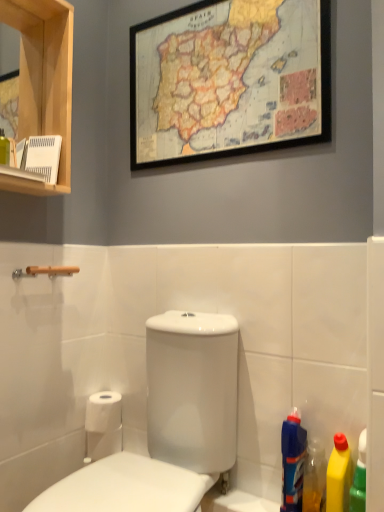
Question: Looking at their shapes, would you say blue plastic bottle at lower right, acting as the 1th cleaning product starting from the left, is wider or thinner than white glossy toilet at center?

Choices:
 (A) wide
 (B) thin

Answer: (B)

Question: From a real-world perspective, relative to white glossy toilet at center, is blue plastic bottle at lower right, acting as the 1th cleaning product starting from the left, vertically above or below?

Choices:
 (A) above
 (B) below

Answer: (B)

Question: Estimate the real-world distances between objects in this image. Which object is farther from the white glossy toilet at center?

Choices:
 (A) yellow plastic bottle at lower right, which is counted as the first cleaning product, starting from the right
 (B) blue plastic bottle at lower right, acting as the 1th cleaning product starting from the left
 (C) wooden-framed map at upper center
 (D) translucent plastic bottle at lower right, positioned as the 2th cleaning product in left-to-right order
 (E) white matte toilet paper at lower left

Answer: (C)

Question: Based on their relative distances, which object is nearer to the white matte toilet paper at lower left?

Choices:
 (A) white glossy toilet at center
 (B) translucent plastic bottle at lower right, positioned as the 2th cleaning product in left-to-right order
 (C) yellow plastic bottle at lower right, which is counted as the 3th cleaning product, starting from the left
 (D) blue plastic bottle at lower right, which ranks as the 3th cleaning product in right-to-left order
 (E) wooden-framed map at upper center

Answer: (A)